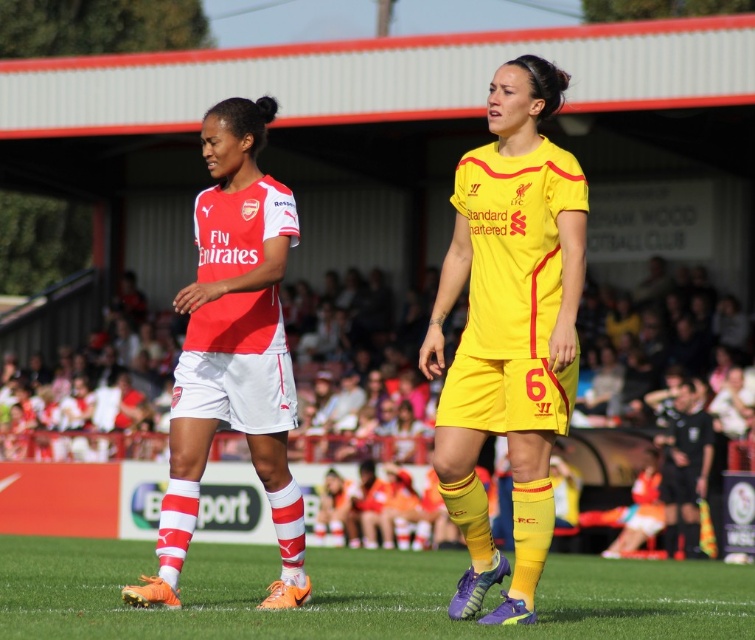
You are a soccer player trying to pass the ball to your teammate. You see the yellow matte jersey at center and the green grass at center. Which one is closer to you?

The yellow matte jersey at center and green grass at center are 16.28 feet apart, so the yellow matte jersey at center is closer to you than the green grass at center.

You are a soccer referee observing the match and need to determine which player is closer to you. You see the yellow matte jersey at center and the matte red and white jersey at center. Which one is nearer?

The yellow matte jersey at center is closer to the viewer than the matte red and white jersey at center, so the player wearing the yellow matte jersey at center is nearer.